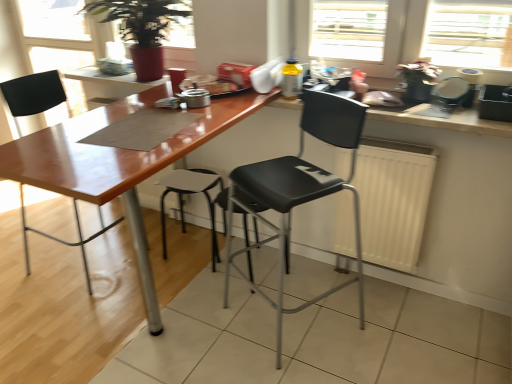
Where is `vacant space underneath black plastic chair at center, placed as the 1th chair when sorted from right to left (from a real-world perspective)`? vacant space underneath black plastic chair at center, placed as the 1th chair when sorted from right to left (from a real-world perspective) is located at coordinates (305, 326).